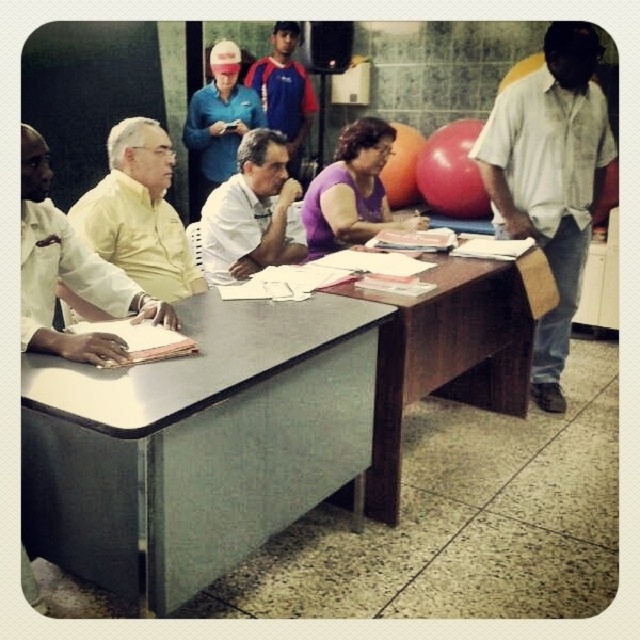
Consider the image. You are a photographer trying to capture a group photo of the purple matte shirt at center and the blue fabric shirt at upper center. Since you want to ensure both are fully visible, which person should you position closer to the camera?

The purple matte shirt at center is not as tall as the blue fabric shirt at upper center, so you should position the purple matte shirt at center closer to the camera to ensure both are fully visible.

You are a photographer trying to capture a candid shot of the purple matte shirt at center and the blue fabric shirt at upper center. Since you want to focus on both subjects equally, which one should you position closer to the camera to ensure they are both in sharp focus?

The purple matte shirt at center is in front of the blue fabric shirt at upper center, so to have both in sharp focus, position the purple matte shirt at center closer to the camera since it is already in front and adjust the depth of field accordingly.

You are a photographer standing behind the group to take a photo. You want to ensure both the white cotton shirt at right and the wooden at center are clearly visible in the shot. Which object should you focus on first to ensure it isn t cropped out?

The white cotton shirt at right is taller than wooden at center, so you should focus on the white cotton shirt at right first to ensure it isn t cropped out since it has a larger height and might require more framing space.